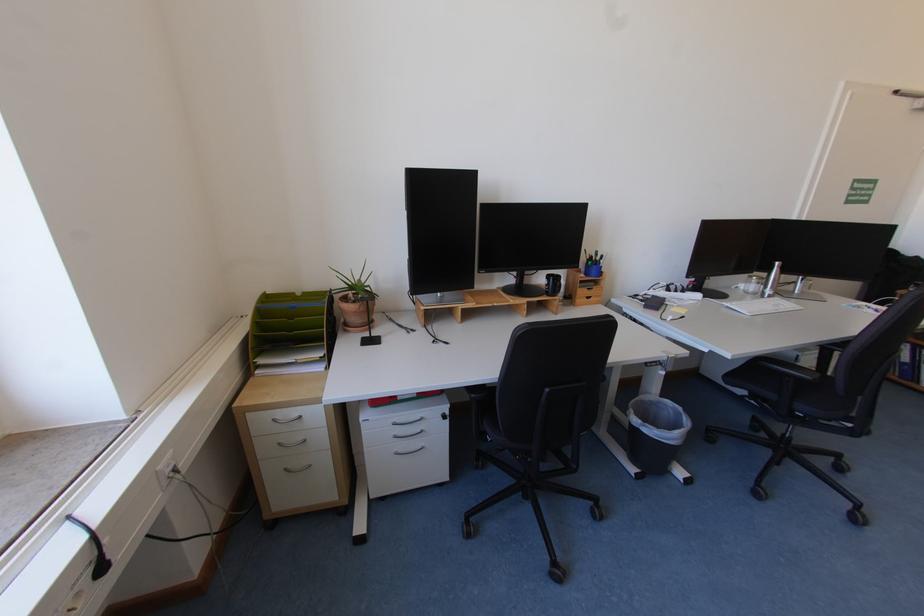
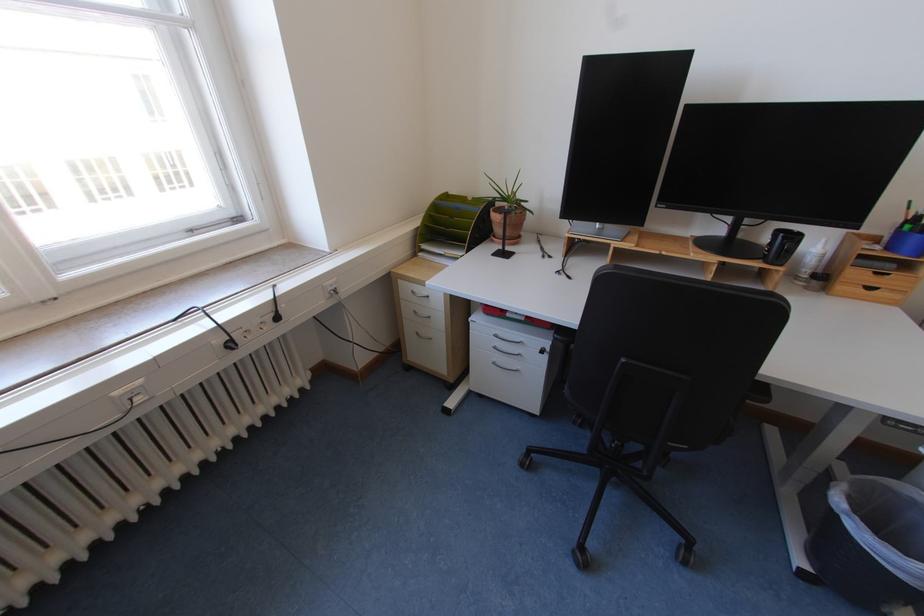
Locate, in the second image, the point that corresponds to pixel 286 445 in the first image.

(422, 312)